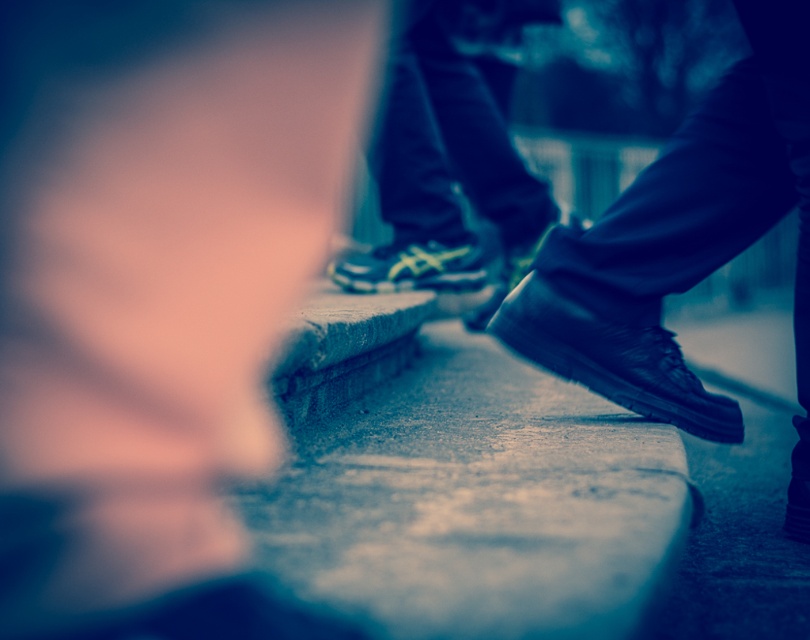
You are a photographer trying to capture a detailed shot of the black leather shoe at lower right and the black leather shoe at center. The camera you are using has a maximum focus range of 25 inches. Can you focus on both shoes simultaneously without moving the camera?

The black leather shoe at lower right is 26.20 inches from the black leather shoe at center. Since the distance between them exceeds the camera maximum focus range of 25 inches, you cannot focus on both shoes simultaneously without moving the camera.

You are standing in front of the concrete ledge where the two pairs of feet are resting. You want to take a photo of the point at coordinate point (448, 260). Is the point within your camera focus range if your camera can focus as close as 8 feet?

The distance of point (448, 260) from camera is 8.13 feet, which is slightly beyond the camera focus range of 8 feet. The point may be out of focus.